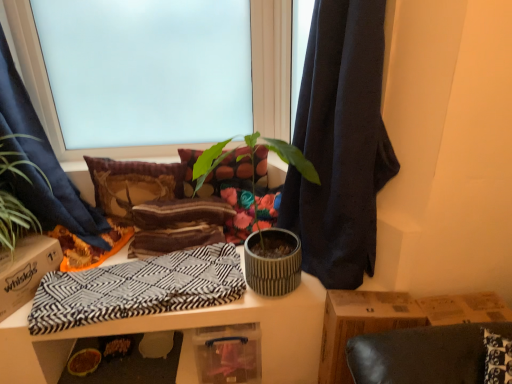
Measure the distance between point (15, 252) and camera.

Point (15, 252) is 1.59 meters from camera.

Image resolution: width=512 pixels, height=384 pixels. In order to click on brown textured pillow at center, the first pillow positioned from the left in this screenshot , I will do `click(133, 184)`.

In order to face green leafy plant at left, positioned as the 2th houseplant in right-to-left order, should I rotate leftwards or rightwards?

It's best to rotate left around 31.756 degrees.

Locate an element on the screen. This screenshot has height=384, width=512. dark blue fabric at center, the 1th curtain in the right-to-left sequence is located at coordinates (340, 143).

Where is `textured fabric pillow at center, which appears as the second pillow when viewed from the left`? This screenshot has width=512, height=384. textured fabric pillow at center, which appears as the second pillow when viewed from the left is located at coordinates (231, 170).

Measure the distance between point (261, 166) and camera.

Point (261, 166) is 1.94 meters away from camera.

This screenshot has width=512, height=384. I want to click on brown cardboard box at left, so click(26, 270).

Looking at their sizes, would you say black and white zigzag fabric at center is wider or thinner than dark blue fabric at center, which ranks as the second curtain in left-to-right order?

In the image, black and white zigzag fabric at center appears to be wider than dark blue fabric at center, which ranks as the second curtain in left-to-right order.

Between point (59, 284) and point (321, 260), which one is positioned behind?

The point (59, 284) is more distant.

Can you confirm if black and white zigzag fabric at center is positioned to the left of dark blue fabric at center, which ranks as the second curtain in left-to-right order?

Yes.

Which of these two, black and white zigzag fabric at center or dark blue fabric at center, which ranks as the second curtain in left-to-right order, is bigger?

dark blue fabric at center, which ranks as the second curtain in left-to-right order, is bigger.

Can you confirm if black and white zigzag fabric at center is positioned to the right of textured concrete pot at center, positioned as the second houseplant in left-to-right order?

No, black and white zigzag fabric at center is not to the right of textured concrete pot at center, positioned as the second houseplant in left-to-right order.

Would you say black and white zigzag fabric at center contains textured concrete pot at center, which is the 1th houseplant in right-to-left order?

No, textured concrete pot at center, which is the 1th houseplant in right-to-left order, is not a part of black and white zigzag fabric at center.

From the image's perspective, which is above, black and white zigzag fabric at center or textured concrete pot at center, positioned as the second houseplant in left-to-right order?

textured concrete pot at center, positioned as the second houseplant in left-to-right order.

From a real-world perspective, is black and white zigzag fabric at center beneath textured concrete pot at center, which is the 1th houseplant in right-to-left order?

Yes.

From a real-world perspective, is blue fabric curtain at left, which is the 1th curtain from left to right, on top of frosted glass window at upper center?

Incorrect, from a real-world perspective, blue fabric curtain at left, which is the 1th curtain from left to right, is lower than frosted glass window at upper center.

Does point (40, 126) lie in front of point (57, 157)?

Yes, it is.

Is blue fabric curtain at left, which is the 1th curtain from left to right, wider or thinner than frosted glass window at upper center?

Clearly, blue fabric curtain at left, which is the 1th curtain from left to right, has more width compared to frosted glass window at upper center.

Consider the image. Is blue fabric curtain at left, the 2th curtain positioned from the right, looking in the opposite direction of frosted glass window at upper center?

No, frosted glass window at upper center is not at the back of blue fabric curtain at left, the 2th curtain positioned from the right.

From a real-world perspective, who is located lower, frosted glass window at upper center or black and white zigzag fabric at center?

black and white zigzag fabric at center.

Identify the location of material that is under the frosted glass window at upper center (from a real-world perspective). (138, 289).

Which of these two, frosted glass window at upper center or black and white zigzag fabric at center, stands taller?

frosted glass window at upper center is taller.

Is frosted glass window at upper center inside or outside of black and white zigzag fabric at center?

frosted glass window at upper center cannot be found inside black and white zigzag fabric at center.

Is brown textured pillow at center, the first pillow positioned from the left, directly adjacent to brown cardboard box at left?

No, brown textured pillow at center, the first pillow positioned from the left, is not making contact with brown cardboard box at left.

At what (x,y) coordinates should I click in order to perform the action: click on cardboard box that is in front of the brown textured pillow at center, which is the second pillow in right-to-left order. Please return your answer as a coordinate pair (x, y). Looking at the image, I should click on (26, 270).

Is brown cardboard box at left inside brown textured pillow at center, the first pillow positioned from the left?

No.

Is blue fabric curtain at left, the 2th curtain positioned from the right, facing away from dark blue fabric at center, the 1th curtain in the right-to-left sequence?

blue fabric curtain at left, the 2th curtain positioned from the right, does not have its back to dark blue fabric at center, the 1th curtain in the right-to-left sequence.

Does point (11, 140) come farther from viewer compared to point (324, 38)?

Yes, it is.

How different are the orientations of blue fabric curtain at left, the 2th curtain positioned from the right, and dark blue fabric at center, the 1th curtain in the right-to-left sequence, in degrees?

The angular difference between blue fabric curtain at left, the 2th curtain positioned from the right, and dark blue fabric at center, the 1th curtain in the right-to-left sequence, is 123 degrees.

From the image's perspective, is blue fabric curtain at left, which is the 1th curtain from left to right, above dark blue fabric at center, which ranks as the second curtain in left-to-right order?

No, from the image's perspective, blue fabric curtain at left, which is the 1th curtain from left to right, is not over dark blue fabric at center, which ranks as the second curtain in left-to-right order.

From the picture: Does frosted glass window at upper center turn towards green leafy plant at left, marked as the first houseplant in a left-to-right arrangement?

Yes.

Does frosted glass window at upper center have a lesser height compared to green leafy plant at left, marked as the first houseplant in a left-to-right arrangement?

Incorrect, the height of frosted glass window at upper center does not fall short of that of green leafy plant at left, marked as the first houseplant in a left-to-right arrangement.

Would you say frosted glass window at upper center is to the left or to the right of green leafy plant at left, positioned as the 2th houseplant in right-to-left order, in the picture?

frosted glass window at upper center is to the right of green leafy plant at left, positioned as the 2th houseplant in right-to-left order.

Is frosted glass window at upper center in front of or behind green leafy plant at left, marked as the first houseplant in a left-to-right arrangement, in the image?

Visually, frosted glass window at upper center is located behind green leafy plant at left, marked as the first houseplant in a left-to-right arrangement.

Locate an element on the screen. The image size is (512, 384). material below the dark blue fabric at center, the 1th curtain in the right-to-left sequence (from the image's perspective) is located at coordinates (138, 289).

At what (x,y) coordinates should I click in order to perform the action: click on material that appears on the left of textured concrete pot at center, which is the 1th houseplant in right-to-left order. Please return your answer as a coordinate pair (x, y). Image resolution: width=512 pixels, height=384 pixels. Looking at the image, I should click on (138, 289).

From the image, which object appears to be farther from textured fabric pillow at center, marked as the first pillow in a right-to-left arrangement, dark blue fabric at center, which ranks as the second curtain in left-to-right order, or frosted glass window at upper center?

dark blue fabric at center, which ranks as the second curtain in left-to-right order, is further to textured fabric pillow at center, marked as the first pillow in a right-to-left arrangement.

Based on their spatial positions, is blue fabric curtain at left, the 2th curtain positioned from the right, or dark blue fabric at center, the 1th curtain in the right-to-left sequence, further from green leafy plant at left, positioned as the 2th houseplant in right-to-left order?

Based on the image, dark blue fabric at center, the 1th curtain in the right-to-left sequence, appears to be further to green leafy plant at left, positioned as the 2th houseplant in right-to-left order.

Based on their spatial positions, is frosted glass window at upper center or brown cardboard box at left closer to black and white zigzag fabric at center?

brown cardboard box at left is positioned closer to the anchor black and white zigzag fabric at center.

Looking at the image, which one is located closer to textured fabric pillow at center, which appears as the second pillow when viewed from the left, blue fabric curtain at left, the 2th curtain positioned from the right, or brown cardboard box at left?

blue fabric curtain at left, the 2th curtain positioned from the right, lies closer to textured fabric pillow at center, which appears as the second pillow when viewed from the left, than the other object.

Looking at the image, which one is located closer to blue fabric curtain at left, the 2th curtain positioned from the right, brown cardboard box at left or dark blue fabric at center, which ranks as the second curtain in left-to-right order?

brown cardboard box at left lies closer to blue fabric curtain at left, the 2th curtain positioned from the right, than the other object.

When comparing their distances from blue fabric curtain at left, which is the 1th curtain from left to right, does black and white zigzag fabric at center or brown cardboard box at left seem closer?

Based on the image, brown cardboard box at left appears to be nearer to blue fabric curtain at left, which is the 1th curtain from left to right.

Looking at the image, which one is located closer to dark blue fabric at center, which ranks as the second curtain in left-to-right order, textured fabric pillow at center, marked as the first pillow in a right-to-left arrangement, or blue fabric curtain at left, the 2th curtain positioned from the right?

textured fabric pillow at center, marked as the first pillow in a right-to-left arrangement, lies closer to dark blue fabric at center, which ranks as the second curtain in left-to-right order, than the other object.

Considering their positions, is textured concrete pot at center, which is the 1th houseplant in right-to-left order, positioned further to blue fabric curtain at left, the 2th curtain positioned from the right, than brown cardboard box at left?

The object further to blue fabric curtain at left, the 2th curtain positioned from the right, is textured concrete pot at center, which is the 1th houseplant in right-to-left order.

You are a GUI agent. You are given a task and a screenshot of the screen. Output one action in this format:
    pyautogui.click(x=<x>, y=<y>)
    Task: Click on the houseplant between green leafy plant at left, positioned as the 2th houseplant in right-to-left order, and dark blue fabric at center, the 1th curtain in the right-to-left sequence, from left to right
    This screenshot has width=512, height=384.
    Given the screenshot: What is the action you would take?
    pyautogui.click(x=252, y=162)

At what (x,y) coordinates should I click in order to perform the action: click on pillow located between green leafy plant at left, positioned as the 2th houseplant in right-to-left order, and textured fabric pillow at center, marked as the first pillow in a right-to-left arrangement, in the depth direction. Please return your answer as a coordinate pair (x, y). Looking at the image, I should click on (133, 184).

Find the location of a particular element. Image resolution: width=512 pixels, height=384 pixels. material between blue fabric curtain at left, which is the 1th curtain from left to right, and textured fabric pillow at center, which appears as the second pillow when viewed from the left, in the front-back direction is located at coordinates (138, 289).

Identify the location of material between blue fabric curtain at left, which is the 1th curtain from left to right, and brown textured pillow at center, which is the second pillow in right-to-left order, from front to back. The height and width of the screenshot is (384, 512). (138, 289).